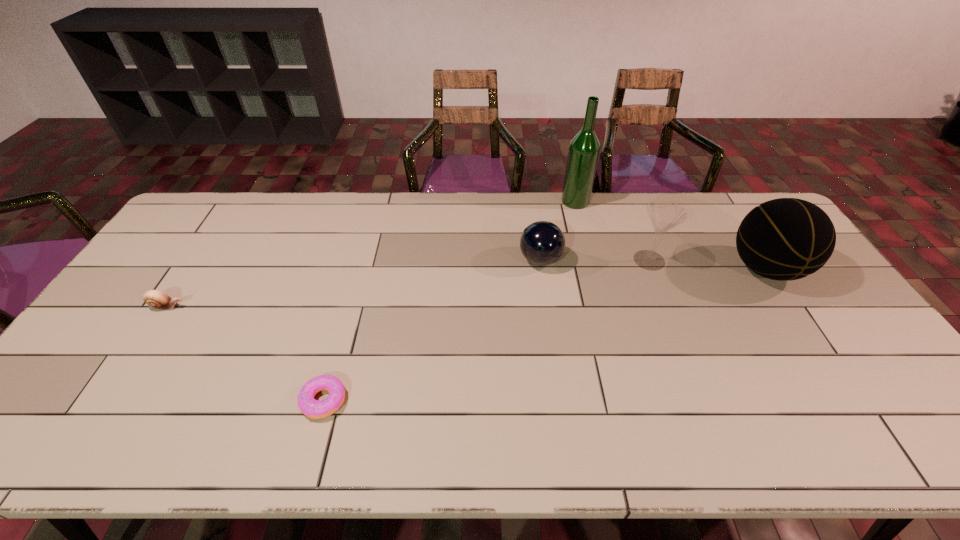
This screenshot has width=960, height=540. I want to click on doughnut, so point(314,409).

Image resolution: width=960 pixels, height=540 pixels. Identify the location of the fifth object from right to left. (314, 409).

Find the location of a particular element. Image resolution: width=960 pixels, height=540 pixels. blank space located 0.310m on the front of the alcohol is located at coordinates (593, 269).

Where is `vacant space located 0.220m on the front of the fifth shortest object`? The width and height of the screenshot is (960, 540). vacant space located 0.220m on the front of the fifth shortest object is located at coordinates (826, 361).

In order to click on free space located on the left of the flute glass in this screenshot , I will do `click(593, 260)`.

Where is `vacant point located 0.200m on the side of the bowling ball with the finger holes`? The height and width of the screenshot is (540, 960). vacant point located 0.200m on the side of the bowling ball with the finger holes is located at coordinates (456, 260).

This screenshot has width=960, height=540. I want to click on free space located on the side of the bowling ball with the finger holes, so click(446, 260).

Locate an element on the screen. This screenshot has width=960, height=540. vacant region located on the side of the bowling ball with the finger holes is located at coordinates (496, 260).

Identify the location of vacant position located 0.130m on the front-facing side of the escargot. The width and height of the screenshot is (960, 540). (231, 307).

Where is `vacant space located on the left of the shortest object`? vacant space located on the left of the shortest object is located at coordinates (204, 400).